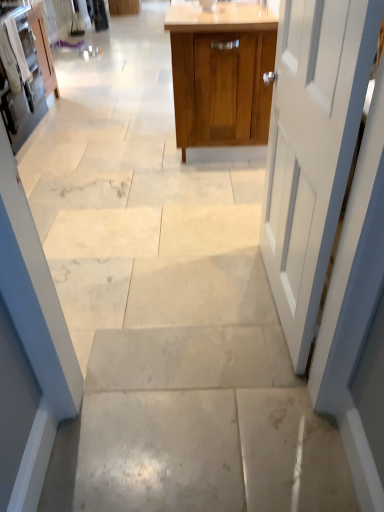
The width and height of the screenshot is (384, 512). Find the location of `vacant area situated below white painted wood door at right (from a real-world perspective)`. vacant area situated below white painted wood door at right (from a real-world perspective) is located at coordinates (268, 293).